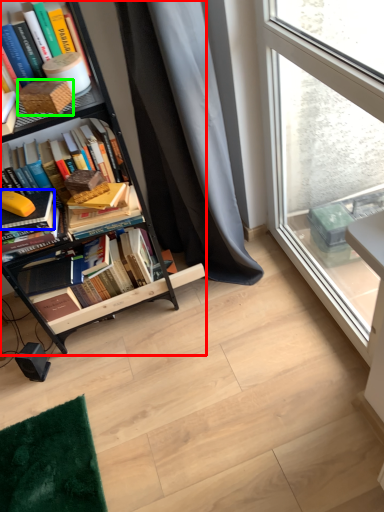
Question: Considering the real-world distances, which object is closest to bookcase (highlighted by a red box)? book (highlighted by a blue box) or paperback book (highlighted by a green box).

Choices:
 (A) book
 (B) paperback book

Answer: (A)